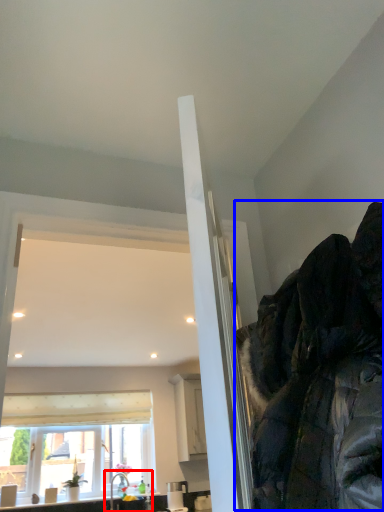
Question: Which point is further to the camera, sink (highlighted by a red box) or jacket (highlighted by a blue box)?

Choices:
 (A) sink
 (B) jacket

Answer: (A)